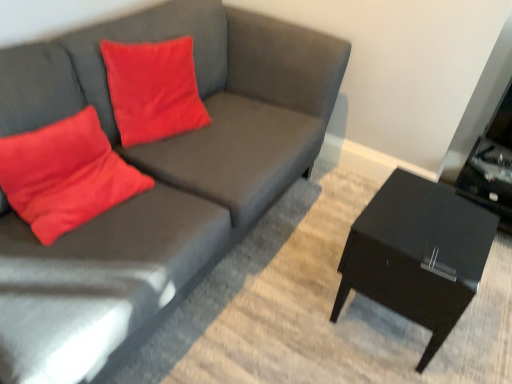
Question: Is matte gray couch at center bigger or smaller than matte red pillow at left?

Choices:
 (A) big
 (B) small

Answer: (A)

Question: From a real-world perspective, is matte gray couch at center positioned above or below matte red pillow at left?

Choices:
 (A) above
 (B) below

Answer: (B)

Question: Estimate the real-world distances between objects in this image. Which object is closer to the black glossy side table at right?

Choices:
 (A) matte red pillow at left
 (B) matte gray couch at center

Answer: (B)

Question: Which object is positioned farthest from the matte red pillow at left?

Choices:
 (A) black glossy side table at right
 (B) matte gray couch at center

Answer: (A)